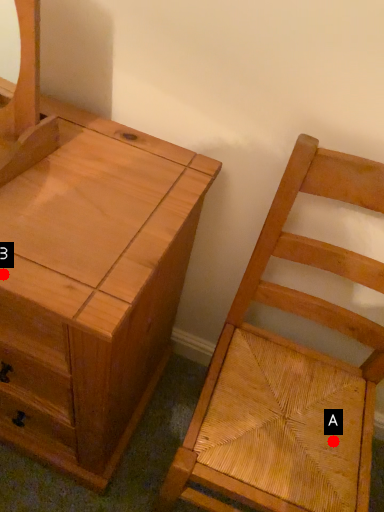
Question: Two points are circled on the image, labeled by A and B beside each circle. Which point is farther to the camera?

Choices:
 (A) A is further
 (B) B is further

Answer: (A)